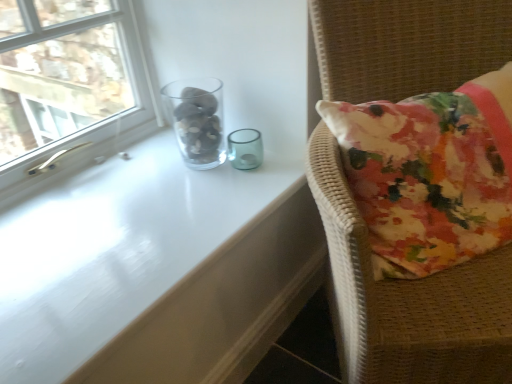
The width and height of the screenshot is (512, 384). I want to click on clear glass window at upper left, so click(69, 84).

The height and width of the screenshot is (384, 512). Identify the location of transparent glass table at upper center. (148, 267).

Does transparent glass table at upper center appear on the left side of floral fabric cushion at right?

Yes, transparent glass table at upper center is to the left of floral fabric cushion at right.

From a real-world perspective, is transparent glass table at upper center below floral fabric cushion at right?

No, from a real-world perspective, transparent glass table at upper center is not below floral fabric cushion at right.

What's the angular difference between transparent glass table at upper center and floral fabric cushion at right's facing directions?

46.4 degrees separate the facing orientations of transparent glass table at upper center and floral fabric cushion at right.

Does transparent glass table at upper center have a smaller size compared to floral fabric cushion at right?

Yes, transparent glass table at upper center is smaller than floral fabric cushion at right.

Does transparent glass vase at upper left have a smaller size compared to floral fabric cushion at right?

Yes, transparent glass vase at upper left is smaller than floral fabric cushion at right.

Which object is positioned more to the right, transparent glass vase at upper left or floral fabric cushion at right?

floral fabric cushion at right.

I want to click on glass vase behind the floral fabric cushion at right, so coord(197,120).

Between point (201, 151) and point (314, 20), which one is positioned in front?

Positioned in front is point (314, 20).

Is transparent glass vase at upper left to the left or to the right of clear glass window at upper left in the image?

transparent glass vase at upper left is to the right of clear glass window at upper left.

Is transparent glass vase at upper left turned away from clear glass window at upper left?

Yes, transparent glass vase at upper left's orientation is away from clear glass window at upper left.

From the image's perspective, between transparent glass vase at upper left and clear glass window at upper left, who is located below?

From the image's view, transparent glass vase at upper left is below.

Would you consider transparent glass vase at upper left to be distant from clear glass window at upper left?

Yes, transparent glass vase at upper left is far from clear glass window at upper left.

Is floral fabric cushion at right not inside transparent glass table at upper center?

Yes, floral fabric cushion at right is not within transparent glass table at upper center.

Looking at this image, is floral fabric cushion at right taller or shorter than transparent glass table at upper center?

Clearly, floral fabric cushion at right is taller compared to transparent glass table at upper center.

Considering the sizes of objects floral fabric cushion at right and transparent glass table at upper center in the image provided, who is wider, floral fabric cushion at right or transparent glass table at upper center?

floral fabric cushion at right is wider.

From the image's perspective, is transparent glass table at upper center below transparent glass vase at upper left?

Yes, from the image's perspective, transparent glass table at upper center is beneath transparent glass vase at upper left.

Is transparent glass table at upper center oriented away from transparent glass vase at upper left?

transparent glass table at upper center is not turned away from transparent glass vase at upper left.

The width and height of the screenshot is (512, 384). Find the location of `table that is below the transparent glass vase at upper left (from the image's perspective)`. table that is below the transparent glass vase at upper left (from the image's perspective) is located at coordinates (148, 267).

Considering the sizes of clear glass window at upper left and transparent glass table at upper center in the image, is clear glass window at upper left wider or thinner than transparent glass table at upper center?

In the image, clear glass window at upper left appears to be more narrow than transparent glass table at upper center.

Are clear glass window at upper left and transparent glass table at upper center making contact?

There is a gap between clear glass window at upper left and transparent glass table at upper center.

Between clear glass window at upper left and transparent glass table at upper center, which one has smaller size?

transparent glass table at upper center.

How much distance is there between clear glass window at upper left and transparent glass table at upper center?

A distance of 6.24 feet exists between clear glass window at upper left and transparent glass table at upper center.

Is transparent glass vase at upper left far from transparent glass table at upper center?

No, transparent glass vase at upper left is in close proximity to transparent glass table at upper center.

The image size is (512, 384). I want to click on glass vase behind the transparent glass table at upper center, so click(197, 120).

Is transparent glass vase at upper left spatially inside transparent glass table at upper center, or outside of it?

transparent glass vase at upper left is spatially situated outside transparent glass table at upper center.

Is transparent glass vase at upper left behind transparent glass table at upper center?

Yes, the depth of transparent glass vase at upper left is greater than that of transparent glass table at upper center.

At what (x,y) coordinates should I click in order to perform the action: click on table positioned vertically above the floral fabric cushion at right (from a real-world perspective). Please return your answer as a coordinate pair (x, y). This screenshot has width=512, height=384. Looking at the image, I should click on (148, 267).

Locate an element on the screen. The height and width of the screenshot is (384, 512). furniture in front of the transparent glass vase at upper left is located at coordinates (409, 300).

Based on their spatial positions, is floral fabric cushion at right or transparent glass vase at upper left closer to transparent glass table at upper center?

Based on the image, transparent glass vase at upper left appears to be nearer to transparent glass table at upper center.

From the picture: Which object lies further to the anchor point floral fabric cushion at right, transparent glass vase at upper left or transparent glass table at upper center?

The object further to floral fabric cushion at right is transparent glass vase at upper left.

Which object lies further to the anchor point floral fabric cushion at right, transparent glass vase at upper left or clear glass window at upper left?

Based on the image, clear glass window at upper left appears to be further to floral fabric cushion at right.

From the picture: Based on their spatial positions, is transparent glass vase at upper left or clear glass window at upper left further from transparent glass table at upper center?

clear glass window at upper left is further to transparent glass table at upper center.

Looking at the image, which one is located further to clear glass window at upper left, floral fabric cushion at right or transparent glass vase at upper left?

Based on the image, floral fabric cushion at right appears to be further to clear glass window at upper left.

Looking at the image, which one is located further to transparent glass vase at upper left, floral fabric cushion at right or clear glass window at upper left?

Among the two, clear glass window at upper left is located further to transparent glass vase at upper left.

Considering their positions, is floral fabric cushion at right positioned further to transparent glass table at upper center than clear glass window at upper left?

Based on the image, clear glass window at upper left appears to be further to transparent glass table at upper center.

From the image, which object appears to be farther from transparent glass table at upper center, clear glass window at upper left or transparent glass vase at upper left?

clear glass window at upper left is positioned further to the anchor transparent glass table at upper center.

Locate an element on the screen. table between clear glass window at upper left and floral fabric cushion at right is located at coordinates (148, 267).

Find the location of a particular element. window located between transparent glass table at upper center and transparent glass vase at upper left in the depth direction is located at coordinates (69, 84).

At what (x,y) coordinates should I click in order to perform the action: click on glass vase between clear glass window at upper left and floral fabric cushion at right in the horizontal direction. Please return your answer as a coordinate pair (x, y). The image size is (512, 384). Looking at the image, I should click on (197, 120).

Where is `glass vase between transparent glass table at upper center and floral fabric cushion at right in the horizontal direction`? This screenshot has height=384, width=512. glass vase between transparent glass table at upper center and floral fabric cushion at right in the horizontal direction is located at coordinates (197, 120).